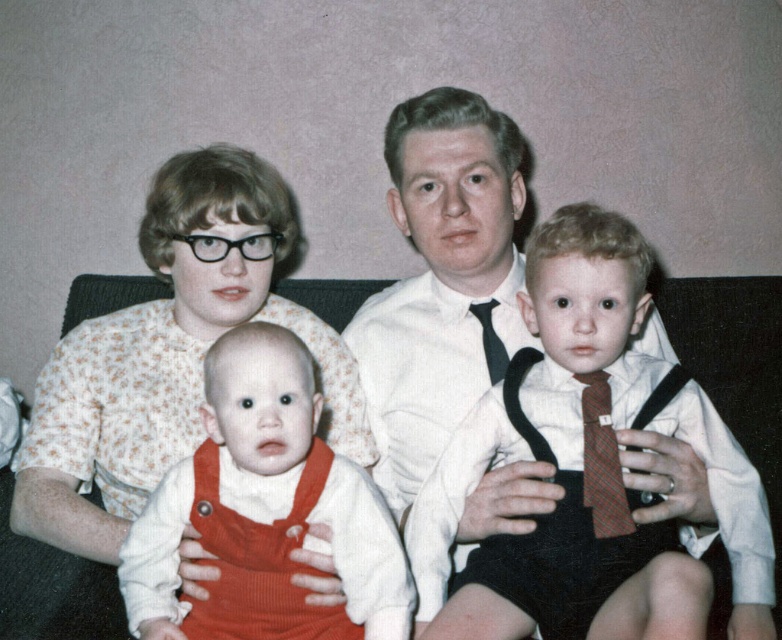
Is matte red suspenders at center to the right of matte corduroy overalls at center from the viewer's perspective?

Indeed, matte red suspenders at center is positioned on the right side of matte corduroy overalls at center.

Can you confirm if matte red suspenders at center is positioned above matte corduroy overalls at center?

Correct, matte red suspenders at center is located above matte corduroy overalls at center.

You are a GUI agent. You are given a task and a screenshot of the screen. Output one action in this format:
    pyautogui.click(x=<x>, y=<y>)
    Task: Click on the matte red suspenders at center
    This screenshot has width=782, height=640.
    Given the screenshot: What is the action you would take?
    pyautogui.click(x=601, y=417)

Where is `matte red suspenders at center`? matte red suspenders at center is located at coordinates (601, 417).

Between floral fabric blouse at upper left and plaid fabric tie at right, which one is positioned lower?

plaid fabric tie at right

Which is behind, point (203, 209) or point (617, 468)?

The point (203, 209) is behind.

Is point (49, 362) positioned after point (626, 516)?

Yes, it is.

The image size is (782, 640). Identify the location of floral fabric blouse at upper left. (167, 355).

Consider the image. Is matte red suspenders at center closer to the viewer compared to plaid fabric tie at right?

Yes, it is in front of plaid fabric tie at right.

Is point (590, 376) in front of point (601, 433)?

No, it is not.

Is point (662, 413) positioned behind point (589, 378)?

Yes, point (662, 413) is farther from viewer.

Image resolution: width=782 pixels, height=640 pixels. Find the location of `matte red suspenders at center`. matte red suspenders at center is located at coordinates (601, 417).